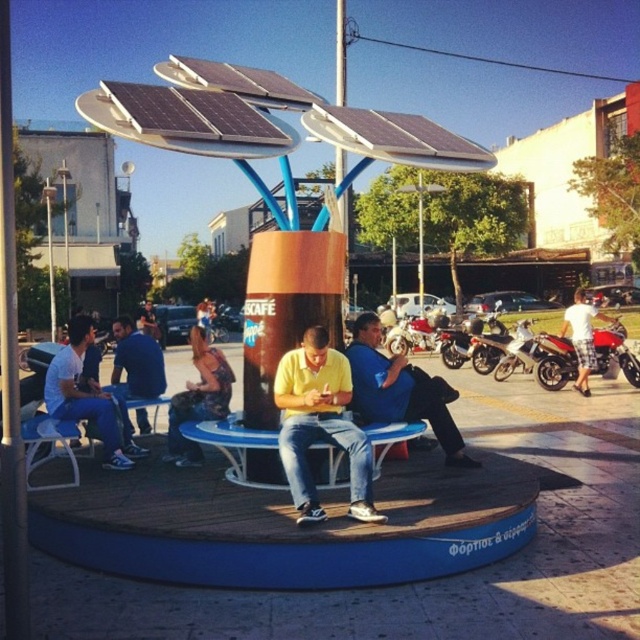
Who is higher up, yellow matte shirt at center or blue plastic bench at center?

A: yellow matte shirt at center is above.

Who is positioned more to the right, yellow matte shirt at center or blue plastic bench at center?

yellow matte shirt at center

This screenshot has width=640, height=640. Identify the location of yellow matte shirt at center. (321, 424).

In order to click on yellow matte shirt at center in this screenshot , I will do `click(321, 424)`.

Does blue denim jeans at left appear on the right side of shiny chrome motorcycle at center?

In fact, blue denim jeans at left is to the left of shiny chrome motorcycle at center.

Can you confirm if blue denim jeans at left is thinner than shiny chrome motorcycle at center?

Yes.

This screenshot has width=640, height=640. What do you see at coordinates (134, 364) in the screenshot?
I see `blue denim jeans at left` at bounding box center [134, 364].

What are the coordinates of `blue denim jeans at left` in the screenshot? It's located at coord(134,364).

Between point (337, 442) and point (141, 392), which one is positioned in front?

Point (337, 442)

Does yellow matte shirt at center appear over blue denim jeans at left?

Incorrect, yellow matte shirt at center is not positioned above blue denim jeans at left.

Where is `yellow matte shirt at center`? Image resolution: width=640 pixels, height=640 pixels. yellow matte shirt at center is located at coordinates (321, 424).